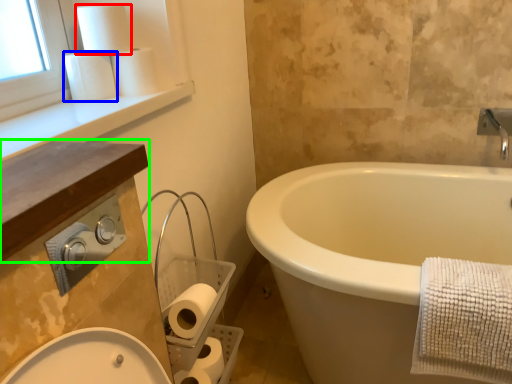
Question: Considering the real-world distances, which object is farthest from toilet paper (highlighted by a red box)? toilet paper (highlighted by a blue box) or counter top (highlighted by a green box)?

Choices:
 (A) toilet paper
 (B) counter top

Answer: (B)